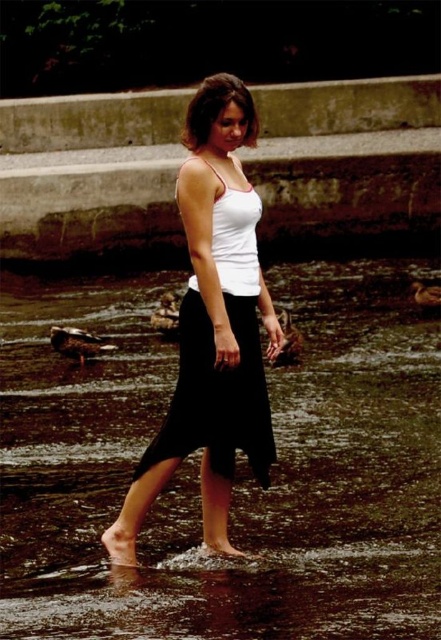
Does clear water at center appear on the left side of white matte tank top at center?

In fact, clear water at center is to the right of white matte tank top at center.

Who is shorter, clear water at center or white matte tank top at center?

white matte tank top at center

This screenshot has height=640, width=441. What do you see at coordinates (236, 467) in the screenshot? I see `clear water at center` at bounding box center [236, 467].

You are a GUI agent. You are given a task and a screenshot of the screen. Output one action in this format:
    pyautogui.click(x=<x>, y=<y>)
    Task: Click on the clear water at center
    The height and width of the screenshot is (640, 441).
    Given the screenshot: What is the action you would take?
    pyautogui.click(x=236, y=467)